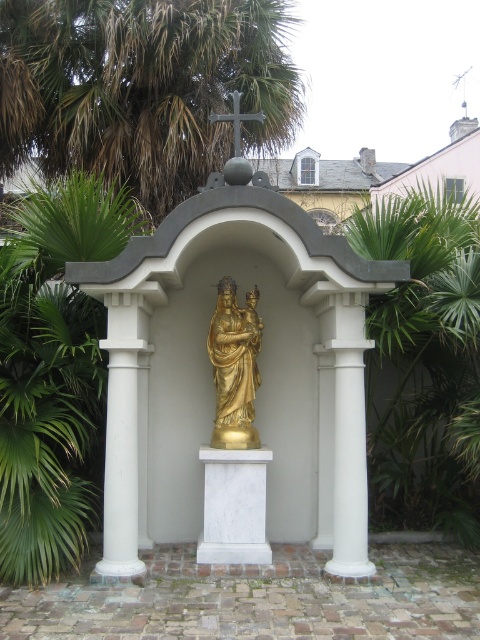
Who is positioned more to the left, green leafy palm tree at upper left or gold polished statue at center?

From the viewer's perspective, green leafy palm tree at upper left appears more on the left side.

Does green leafy palm tree at upper left have a lesser width compared to gold polished statue at center?

No, green leafy palm tree at upper left is not thinner than gold polished statue at center.

Locate an element on the screen. The height and width of the screenshot is (640, 480). green leafy palm tree at upper left is located at coordinates (142, 88).

In order to click on white marble column at center in this screenshot , I will do `click(124, 435)`.

Does point (109, 497) lie in front of point (253, 364)?

Yes, it is in front of point (253, 364).

Is point (104, 547) farther from viewer compared to point (242, 332)?

No.

Where is `white marble column at center`? The width and height of the screenshot is (480, 640). white marble column at center is located at coordinates (124, 435).

This screenshot has width=480, height=640. What are the coordinates of `green leafy palm tree at upper left` in the screenshot? It's located at (142, 88).

Who is more forward, (253, 20) or (396, 406)?

Positioned in front is point (396, 406).

Is point (34, 1) farther from camera compared to point (382, 448)?

Yes, it is.

The width and height of the screenshot is (480, 640). Identify the location of green leafy palm tree at upper left. (142, 88).